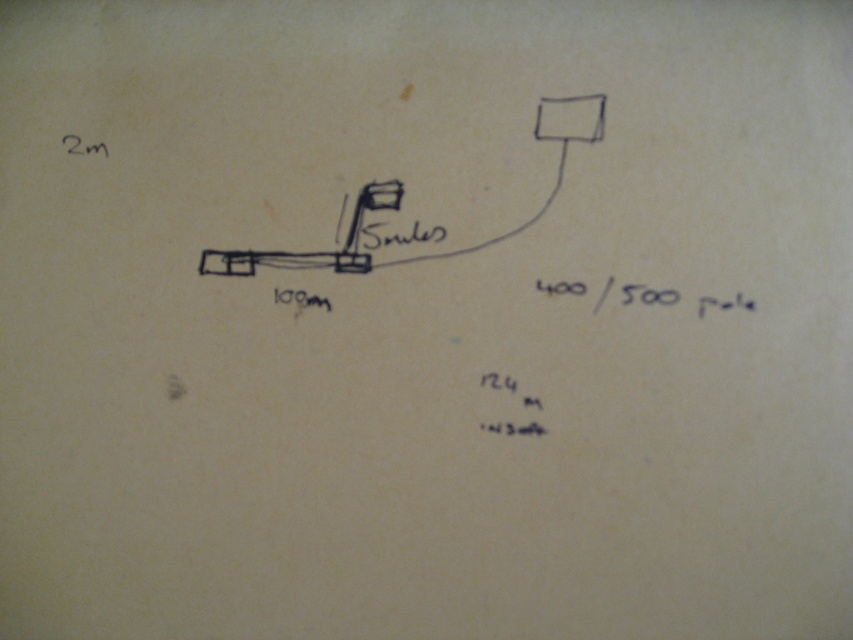
Question: Is black paper at lower center to the left of black ink writing at center from the viewer's perspective?

Choices:
 (A) no
 (B) yes

Answer: (A)

Question: Which point is farther to the camera?

Choices:
 (A) black ink writing at center
 (B) black paper at lower center

Answer: (A)

Question: Can you confirm if black paper at lower center is positioned to the right of black ink writing at center?

Choices:
 (A) no
 (B) yes

Answer: (B)

Question: Is black paper at lower center in front of black ink writing at center?

Choices:
 (A) no
 (B) yes

Answer: (B)

Question: Among these objects, which one is nearest to the camera?

Choices:
 (A) black paper at lower center
 (B) black ink writing at center

Answer: (A)